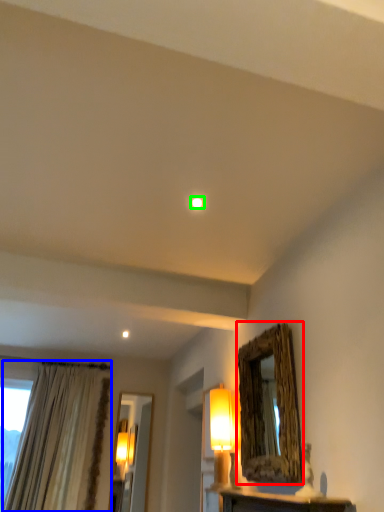
Question: Considering the real-world distances, which object is closest to mirror (highlighted by a red box)? curtain (highlighted by a blue box) or lighting (highlighted by a green box).

Choices:
 (A) curtain
 (B) lighting

Answer: (B)